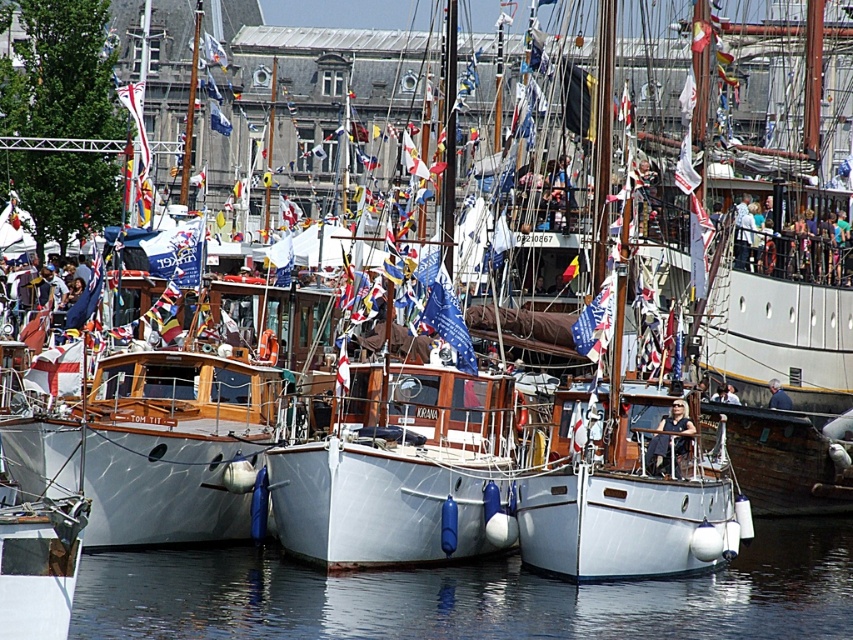
Can you confirm if transparent water at lower center is thinner than white matte boat at center?

No, transparent water at lower center is not thinner than white matte boat at center.

Is point (93, 588) more distant than point (399, 534)?

No.

Is point (192, 611) positioned after point (384, 440)?

No, it is in front of (384, 440).

Where is `transparent water at lower center`? transparent water at lower center is located at coordinates coord(469,595).